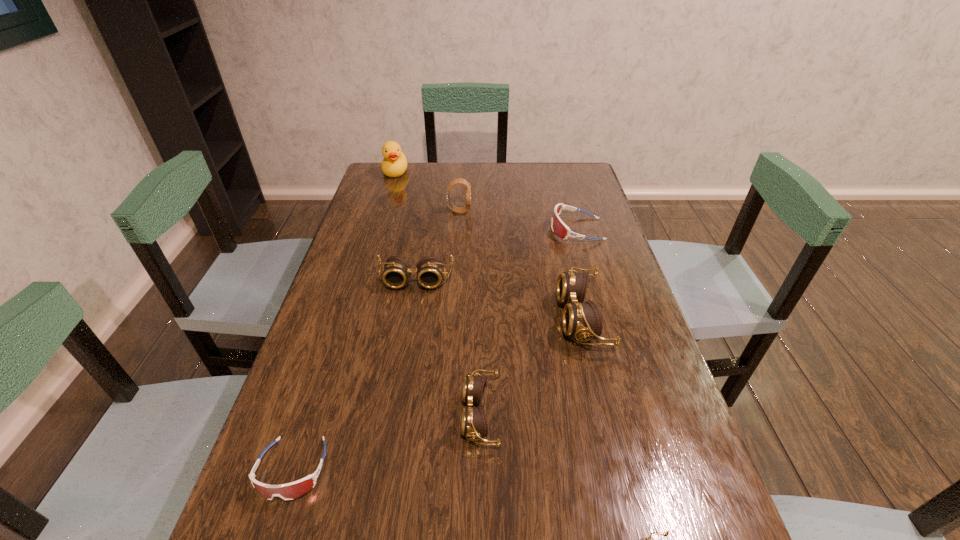
The image size is (960, 540). Find the location of `the third closest goggles to the leftmost goggles`. the third closest goggles to the leftmost goggles is located at coordinates (580, 320).

This screenshot has width=960, height=540. I want to click on the fifth closest goggles to the farther red goggles, so click(293, 490).

Locate which brown goggles is the third closest to the biggest brown goggles. Please provide its 2D coordinates. Your answer should be formatted as a tuple, i.e. [(x, y)], where the tuple contains the x and y coordinates of a point satisfying the conditions above.

[(667, 532)]

Image resolution: width=960 pixels, height=540 pixels. I want to click on brown goggles that stands as the fourth closest to the farthest goggles, so click(x=667, y=532).

Identify the location of free location that satisfies the following two spatial constraints: 1. on the front-facing side of the farther red goggles; 2. through the lenses of the third smallest brown goggles. The width and height of the screenshot is (960, 540). (591, 281).

Where is `vacant region that satisfies the following two spatial constraints: 1. on the face of the watch; 2. through the lenses of the second goggles from left to right`? vacant region that satisfies the following two spatial constraints: 1. on the face of the watch; 2. through the lenses of the second goggles from left to right is located at coordinates (454, 281).

At what (x,y) coordinates should I click in order to perform the action: click on free space that satisfies the following two spatial constraints: 1. through the lenses of the third brown goggles from right to left; 2. on the front-facing side of the smaller red goggles. Please return your answer as a coordinate pair (x, y). The height and width of the screenshot is (540, 960). Looking at the image, I should click on (480, 469).